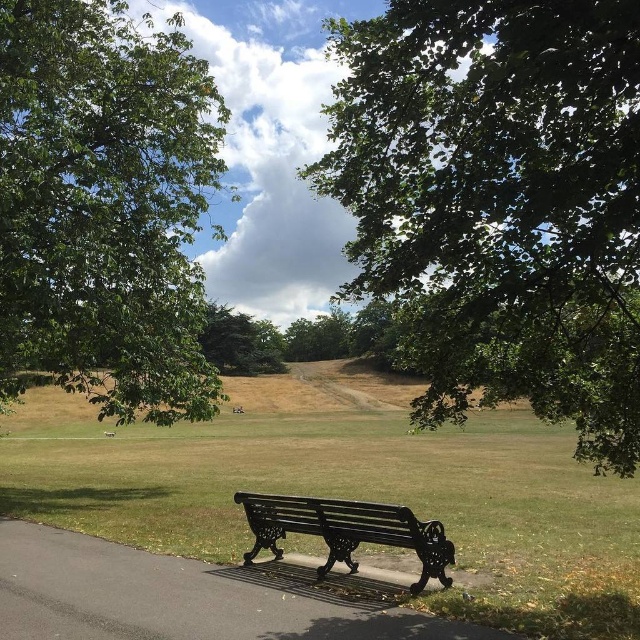
You are standing at the black metal bench with ornate detailing in the park. You notice two points in the scene labeled as point (x=349, y=378) and point (x=273, y=365). Which point is nearer to you?

Point (x=349, y=378) is closer to the viewer than point (x=273, y=365).

You are a park visitor standing at the entrance and see both the black metal bench at center and the black cast iron bench at lower center. Which bench is closer to the entrance?

The black cast iron bench at lower center is closer to the entrance because it is positioned to the lower center, which is typically where entrances are located in such scenes.